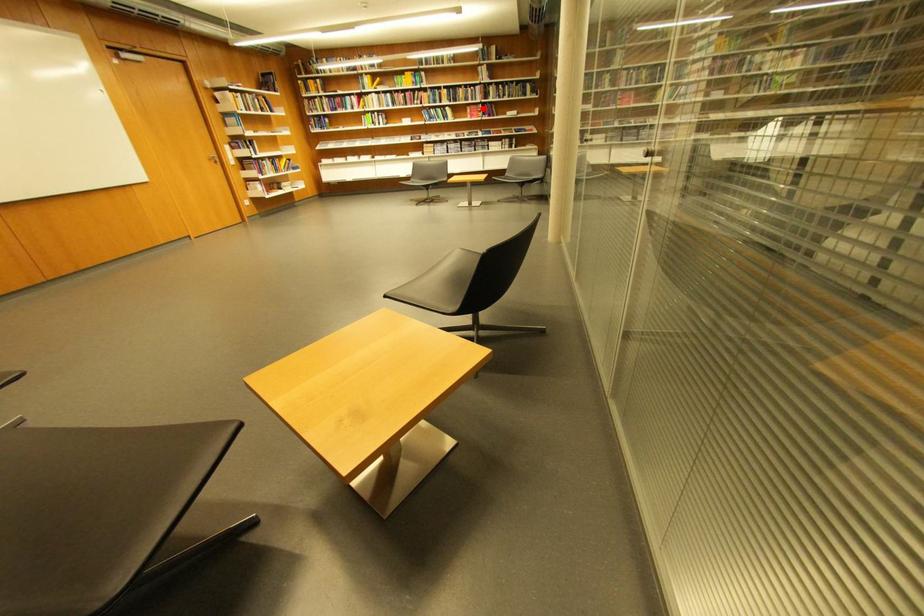
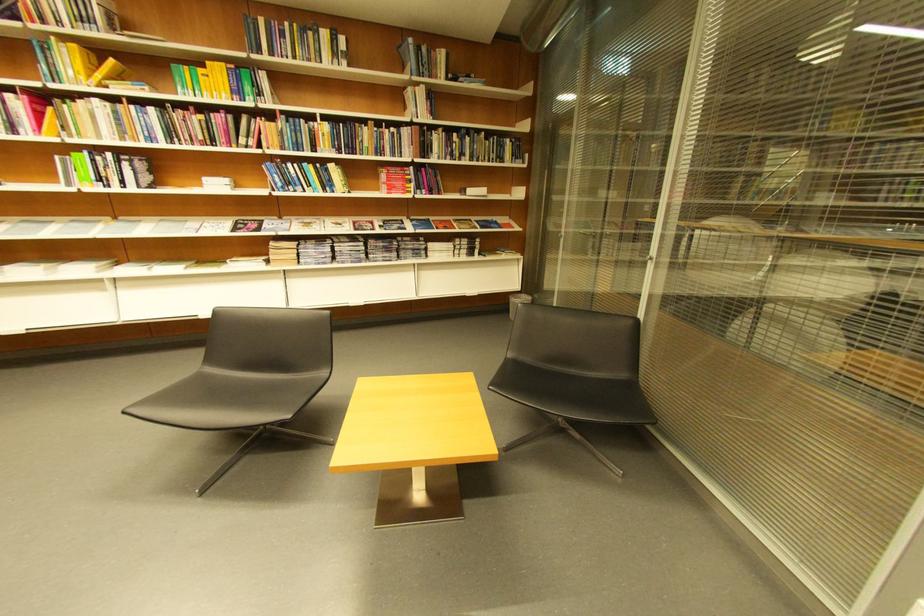
Question: I am providing you with two images of the same scene from different viewpoints. In image1, a red point is highlighted. Considering the same 3D point in image2, which of the following is correct?

Choices:
 (A) It is closer
 (B) It is farther

Answer: (B)